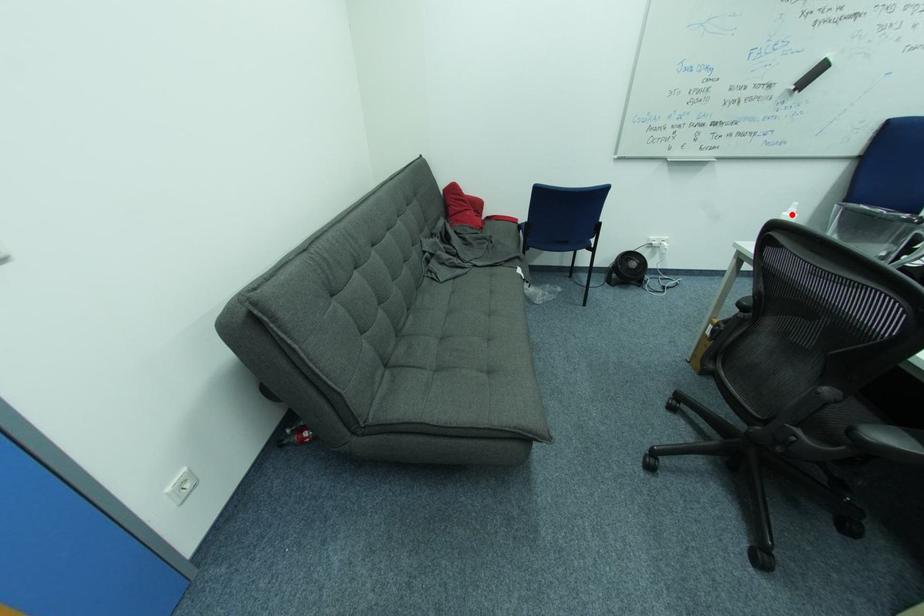
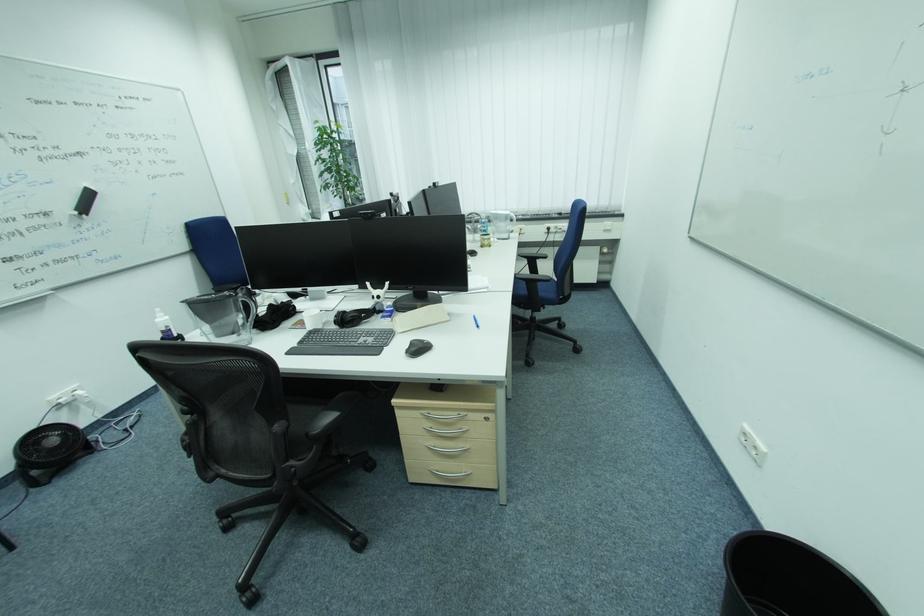
Question: I am providing you with two images of the same scene from different viewpoints. A red point is shown in image1. For the corresponding object point in image2, is it positioned nearer or farther from the camera?

Choices:
 (A) Nearer
 (B) Farther

Answer: (B)